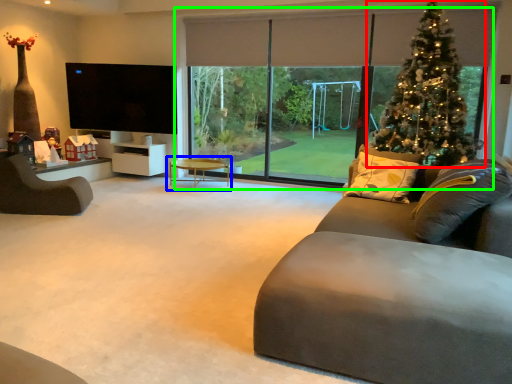
Question: Which is farther away from christmas tree (highlighted by a red box)? coffee table (highlighted by a blue box) or window (highlighted by a green box)?

Choices:
 (A) coffee table
 (B) window

Answer: (A)